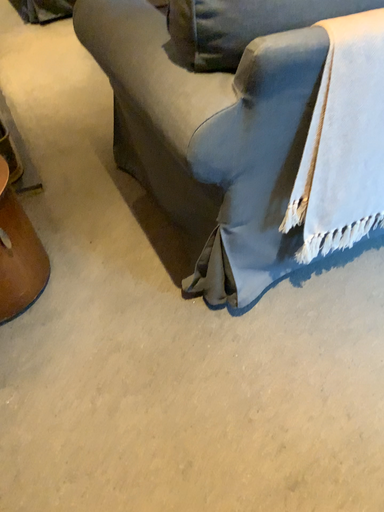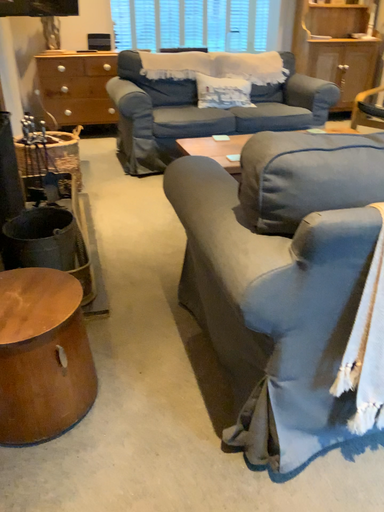
Question: How did the camera likely rotate when shooting the video?

Choices:
 (A) rotated left
 (B) rotated right

Answer: (A)